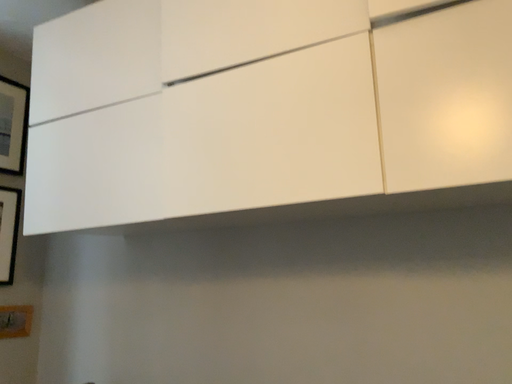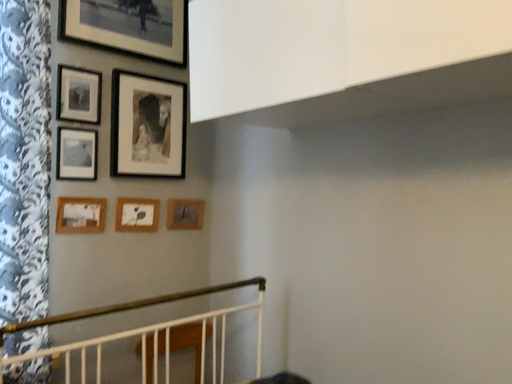
Question: How did the camera likely rotate when shooting the video?

Choices:
 (A) rotated left
 (B) rotated right

Answer: (A)